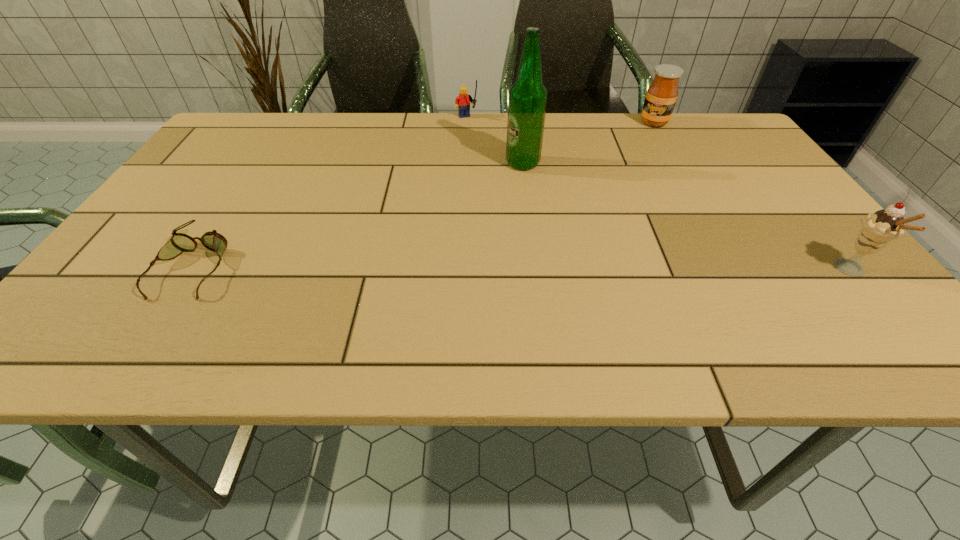
I want to click on vacant space situated on the label of the tallest object, so click(x=478, y=228).

Find the location of a particular element. This screenshot has height=540, width=960. free space located on the label of the tallest object is located at coordinates (497, 200).

This screenshot has width=960, height=540. In order to click on vacant space located 0.310m on the label of the tallest object in this screenshot , I will do `click(465, 248)`.

Locate an element on the screen. Image resolution: width=960 pixels, height=540 pixels. vacant region located 0.150m on the front-facing side of the second object from left to right is located at coordinates (484, 150).

I want to click on free region located on the front-facing side of the second object from left to right, so click(x=501, y=180).

Identify the location of free space located on the front-facing side of the second object from left to right. Image resolution: width=960 pixels, height=540 pixels. (500, 178).

Where is `free location located on the front-facing side of the third shortest object`? free location located on the front-facing side of the third shortest object is located at coordinates 648,144.

This screenshot has width=960, height=540. Identify the location of vacant point located on the front-facing side of the third shortest object. (633, 199).

Locate an element on the screen. free space located 0.300m on the front-facing side of the third shortest object is located at coordinates (636, 185).

Where is `beer bottle present at the far edge`? beer bottle present at the far edge is located at coordinates coord(527,101).